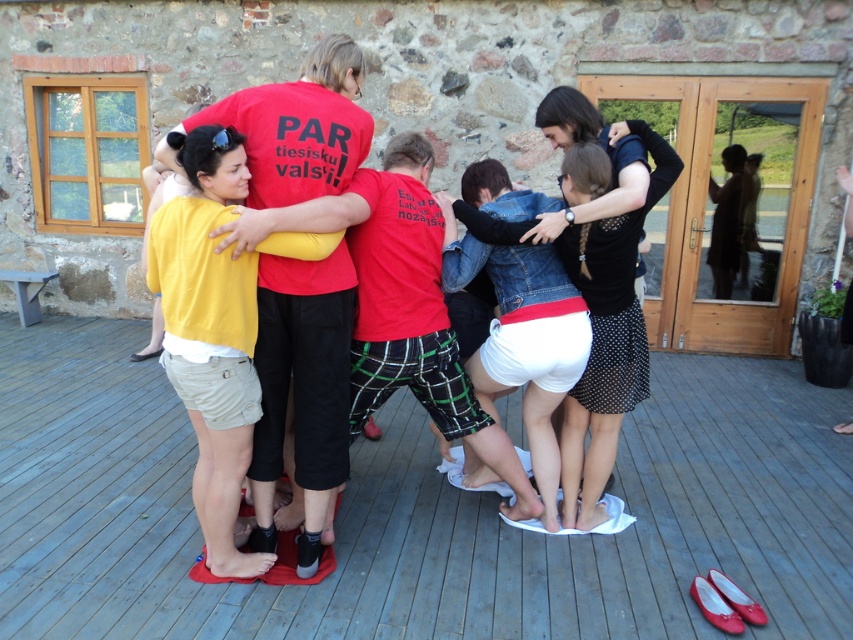
You are standing at the point marked by coordinates (416,513) on the wooden deck at center. Looking towards the double doors with glass panels on the right, which direction should you turn to face the stone wall with the window on the left side?

To face the stone wall with the window on the left side from the wooden deck at center, you should turn to your left. Since the double doors are on your right, turning left would orient you toward the stone wall with the window on the left side.

You are standing on the wooden deck at center. If you face the stone building with the window, which direction should you turn to find the double doors with glass panels?

The wooden deck at center is located at point (416, 513). Since the double doors are on the right side of the stone building, you should turn to your right to face them.